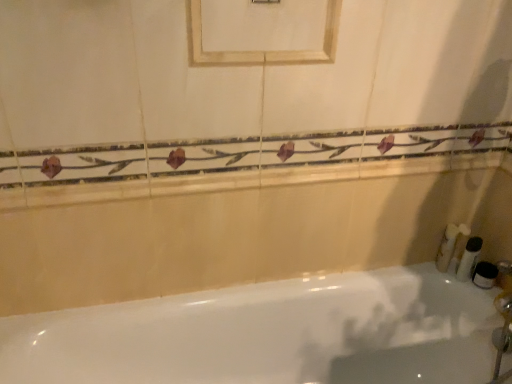
You are a GUI agent. You are given a task and a screenshot of the screen. Output one action in this format:
    pyautogui.click(x=<x>, y=<y>)
    Task: Click on the white matte toothbrushes at right, which is the 2th toiletry in left-to-right order
    
    Given the screenshot: What is the action you would take?
    pyautogui.click(x=458, y=244)

Locate an element on the screen. white fluffy sponge at right, which is counted as the first toiletry, starting from the left is located at coordinates (447, 247).

Are white matte toothbrushes at right, which is the third toiletry from right to left, and porcelain tile balustrade at upper center beside each other?

There is a gap between white matte toothbrushes at right, which is the third toiletry from right to left, and porcelain tile balustrade at upper center.

Which of these two, white matte toothbrushes at right, which is the third toiletry from right to left, or porcelain tile balustrade at upper center, is smaller?

white matte toothbrushes at right, which is the third toiletry from right to left, is smaller.

Is the depth of white matte toothbrushes at right, which is the 2th toiletry in left-to-right order, greater than that of porcelain tile balustrade at upper center?

Yes, it is behind porcelain tile balustrade at upper center.

From a real-world perspective, is white glossy bathtub at lower center below porcelain tile balustrade at upper center?

Correct, in the physical world, white glossy bathtub at lower center is lower than porcelain tile balustrade at upper center.

From the image's perspective, who appears lower, white glossy bathtub at lower center or porcelain tile balustrade at upper center?

white glossy bathtub at lower center appears lower in the image.

What are the coordinates of `bathtub below the porcelain tile balustrade at upper center (from the image's perspective)` in the screenshot? It's located at (268, 334).

Is point (49, 342) positioned in front of point (454, 234)?

That is True.

From a real-world perspective, who is located lower, white glossy bathtub at lower center or white fluffy sponge at right, which is counted as the first toiletry, starting from the left?

white glossy bathtub at lower center is physically lower.

I want to click on the 1st toiletry to the right of the white glossy bathtub at lower center, counting from the anchor's position, so click(x=447, y=247).

Consider the image. Considering their positions, is white glossy bathtub at lower center located in front of or behind white fluffy sponge at right, arranged as the 4th toiletry when viewed from the right?

white glossy bathtub at lower center is in front of white fluffy sponge at right, arranged as the 4th toiletry when viewed from the right.

Is white glossy bathtub at lower center not inside white matte toothbrushes at right, which is the third toiletry from right to left?

white glossy bathtub at lower center lies outside white matte toothbrushes at right, which is the third toiletry from right to left,'s area.

Between white glossy bathtub at lower center and white matte toothbrushes at right, which is the 2th toiletry in left-to-right order, which one appears on the right side from the viewer's perspective?

white matte toothbrushes at right, which is the 2th toiletry in left-to-right order.

Could you tell me if white glossy bathtub at lower center is facing white matte toothbrushes at right, which is the 2th toiletry in left-to-right order?

No, white glossy bathtub at lower center is not facing towards white matte toothbrushes at right, which is the 2th toiletry in left-to-right order.

Which is in front, point (244, 322) or point (455, 239)?

The point (244, 322) is closer to the camera.

Which object is thinner, white fluffy sponge at right, arranged as the 4th toiletry when viewed from the right, or white matte jar at right, which is the first toiletry from right to left?

white matte jar at right, which is the first toiletry from right to left.

Is white fluffy sponge at right, arranged as the 4th toiletry when viewed from the right, positioned behind white matte jar at right, which is the first toiletry from right to left?

Yes, white fluffy sponge at right, arranged as the 4th toiletry when viewed from the right, is further from the camera.

This screenshot has width=512, height=384. There is a white fluffy sponge at right, arranged as the 4th toiletry when viewed from the right. Identify the location of the 2nd toiletry below it (from the image's perspective). (485, 275).

How different are the orientations of white plastic bottle at right, the second toiletry from the right, and white matte jar at right, the fourth toiletry from the left, in degrees?

The angle between the facing direction of white plastic bottle at right, the second toiletry from the right, and the facing direction of white matte jar at right, the fourth toiletry from the left, is 0.00273 degrees.

Can we say white plastic bottle at right, acting as the third toiletry starting from the left, lies outside white matte jar at right, the fourth toiletry from the left?

Absolutely, white plastic bottle at right, acting as the third toiletry starting from the left, is external to white matte jar at right, the fourth toiletry from the left.

From a real-world perspective, does white plastic bottle at right, acting as the third toiletry starting from the left, sit lower than white matte jar at right, the fourth toiletry from the left?

No.

Is white plastic bottle at right, the second toiletry from the right, positioned far away from white matte toothbrushes at right, which is the third toiletry from right to left?

white plastic bottle at right, the second toiletry from the right, is near white matte toothbrushes at right, which is the third toiletry from right to left, not far away.

Where is `toiletry that is the 1st object above the white plastic bottle at right, acting as the third toiletry starting from the left (from a real-world perspective)`? toiletry that is the 1st object above the white plastic bottle at right, acting as the third toiletry starting from the left (from a real-world perspective) is located at coordinates (458, 244).

Considering the sizes of white plastic bottle at right, acting as the third toiletry starting from the left, and white matte toothbrushes at right, which is the 2th toiletry in left-to-right order, in the image, is white plastic bottle at right, acting as the third toiletry starting from the left, bigger or smaller than white matte toothbrushes at right, which is the 2th toiletry in left-to-right order,?

white plastic bottle at right, acting as the third toiletry starting from the left, is smaller than white matte toothbrushes at right, which is the 2th toiletry in left-to-right order.

Between white plastic bottle at right, acting as the third toiletry starting from the left, and white matte toothbrushes at right, which is the 2th toiletry in left-to-right order, which one has larger width?

white matte toothbrushes at right, which is the 2th toiletry in left-to-right order.

The width and height of the screenshot is (512, 384). I want to click on the 4th toiletry behind the porcelain tile balustrade at upper center, so click(458, 244).

Locate an element on the screen. balustrade located on the right of white glossy bathtub at lower center is located at coordinates (243, 179).

Which object lies further to the anchor point white fluffy sponge at right, which is counted as the first toiletry, starting from the left, white matte jar at right, which is the first toiletry from right to left, or porcelain tile balustrade at upper center?

porcelain tile balustrade at upper center is further to white fluffy sponge at right, which is counted as the first toiletry, starting from the left.

Which object lies nearer to the anchor point white plastic bottle at right, the second toiletry from the right, white matte toothbrushes at right, which is the 2th toiletry in left-to-right order, or white glossy bathtub at lower center?

white matte toothbrushes at right, which is the 2th toiletry in left-to-right order, lies closer to white plastic bottle at right, the second toiletry from the right, than the other object.

From the image, which object appears to be farther from white plastic bottle at right, acting as the third toiletry starting from the left, white matte jar at right, the fourth toiletry from the left, or white fluffy sponge at right, which is counted as the first toiletry, starting from the left?

white fluffy sponge at right, which is counted as the first toiletry, starting from the left, lies further to white plastic bottle at right, acting as the third toiletry starting from the left, than the other object.

Considering their positions, is white fluffy sponge at right, arranged as the 4th toiletry when viewed from the right, positioned closer to white matte toothbrushes at right, which is the third toiletry from right to left, than white glossy bathtub at lower center?

white fluffy sponge at right, arranged as the 4th toiletry when viewed from the right.

Based on their spatial positions, is white fluffy sponge at right, arranged as the 4th toiletry when viewed from the right, or porcelain tile balustrade at upper center further from white matte jar at right, the fourth toiletry from the left?

porcelain tile balustrade at upper center is further to white matte jar at right, the fourth toiletry from the left.

Considering their positions, is porcelain tile balustrade at upper center positioned closer to white glossy bathtub at lower center than white matte jar at right, the fourth toiletry from the left?

porcelain tile balustrade at upper center is closer to white glossy bathtub at lower center.

Considering their positions, is white glossy bathtub at lower center positioned further to white matte jar at right, which is the first toiletry from right to left, than porcelain tile balustrade at upper center?

The object further to white matte jar at right, which is the first toiletry from right to left, is porcelain tile balustrade at upper center.

Estimate the real-world distances between objects in this image. Which object is further from white matte jar at right, which is the first toiletry from right to left, white matte toothbrushes at right, which is the 2th toiletry in left-to-right order, or white glossy bathtub at lower center?

Based on the image, white glossy bathtub at lower center appears to be further to white matte jar at right, which is the first toiletry from right to left.

This screenshot has height=384, width=512. Identify the location of toiletry between white fluffy sponge at right, arranged as the 4th toiletry when viewed from the right, and white plastic bottle at right, acting as the third toiletry starting from the left, in the horizontal direction. (458, 244).

At what (x,y) coordinates should I click in order to perform the action: click on balustrade between white glossy bathtub at lower center and white plastic bottle at right, acting as the third toiletry starting from the left, from left to right. Please return your answer as a coordinate pair (x, y). The width and height of the screenshot is (512, 384). Looking at the image, I should click on (243, 179).

At what (x,y) coordinates should I click in order to perform the action: click on balustrade located between white glossy bathtub at lower center and white fluffy sponge at right, arranged as the 4th toiletry when viewed from the right, in the left-right direction. Please return your answer as a coordinate pair (x, y). Looking at the image, I should click on (243, 179).

The width and height of the screenshot is (512, 384). What are the coordinates of `toiletry between white glossy bathtub at lower center and white matte toothbrushes at right, which is the 2th toiletry in left-to-right order, from left to right` in the screenshot? It's located at (447, 247).